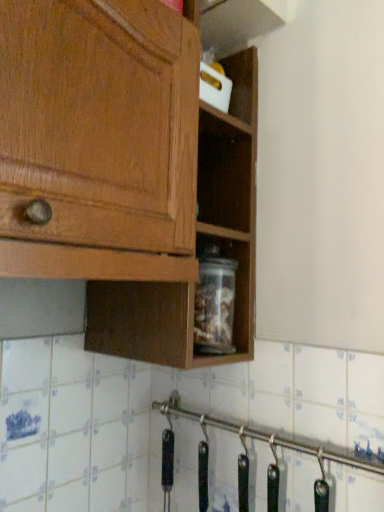
Describe the element at coordinates (278, 438) in the screenshot. I see `black rubber hooks at lower right` at that location.

Locate an element on the screen. This screenshot has width=384, height=512. black rubber hooks at lower right is located at coordinates (278, 438).

Measure the distance between point (347,450) and camera.

The depth of point (347,450) is 72.40 centimeters.

Locate an element on the screen. Image resolution: width=384 pixels, height=512 pixels. black rubber hooks at lower right is located at coordinates (278, 438).